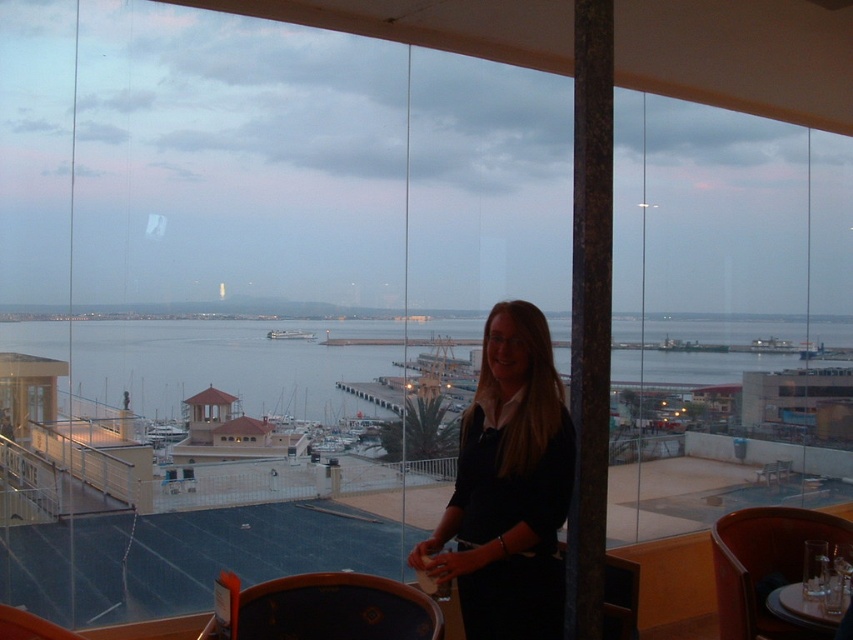
Question: Which object appears farthest from the camera in this image?

Choices:
 (A) dark wood table at center
 (B) black matte shirt at center

Answer: (B)

Question: Can you confirm if blue water at center is smaller than black matte shirt at center?

Choices:
 (A) no
 (B) yes

Answer: (A)

Question: Is black matte shirt at center in front of brown marble pillar at center?

Choices:
 (A) no
 (B) yes

Answer: (A)

Question: Which point is closer to the camera?

Choices:
 (A) (267, 624)
 (B) (592, 17)
 (C) (799, 588)
 (D) (292, 358)

Answer: (B)

Question: Can you confirm if black matte shirt at center is thinner than dark wood table at center?

Choices:
 (A) yes
 (B) no

Answer: (A)

Question: Which is nearer to the blue water at center?

Choices:
 (A) dark wood table at center
 (B) brown marble pillar at center
 (C) translucent glass table at center

Answer: (A)